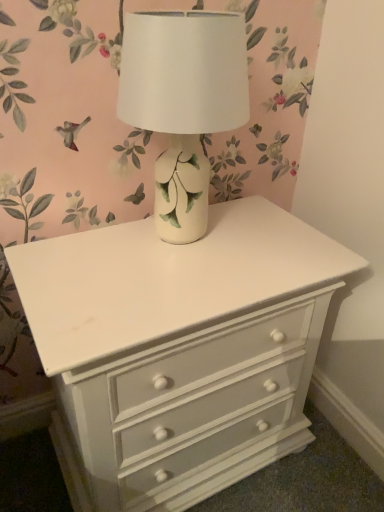
Question: Is white ceramic table lamp at center bigger or smaller than white painted wood chest of drawers at center?

Choices:
 (A) big
 (B) small

Answer: (B)

Question: From a real-world perspective, is white ceramic table lamp at center above or below white painted wood chest of drawers at center?

Choices:
 (A) below
 (B) above

Answer: (B)

Question: Considering the positions of white ceramic table lamp at center and white painted wood chest of drawers at center in the image, is white ceramic table lamp at center taller or shorter than white painted wood chest of drawers at center?

Choices:
 (A) tall
 (B) short

Answer: (B)

Question: Based on their positions, is white painted wood chest of drawers at center located to the left or right of white ceramic table lamp at center?

Choices:
 (A) left
 (B) right

Answer: (B)

Question: Considering the positions of point (301, 404) and point (158, 227), is point (301, 404) closer or farther from the camera than point (158, 227)?

Choices:
 (A) closer
 (B) farther

Answer: (B)

Question: Is white painted wood chest of drawers at center spatially inside white ceramic table lamp at center, or outside of it?

Choices:
 (A) outside
 (B) inside

Answer: (A)

Question: From a real-world perspective, is white painted wood chest of drawers at center positioned above or below white ceramic table lamp at center?

Choices:
 (A) below
 (B) above

Answer: (A)